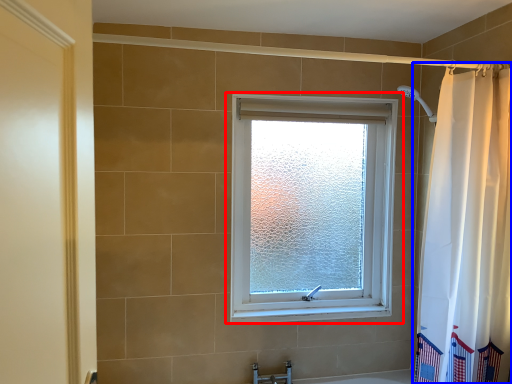
Question: Which of the following is the farthest to the observer, window (highlighted by a red box) or curtain (highlighted by a blue box)?

Choices:
 (A) window
 (B) curtain

Answer: (A)